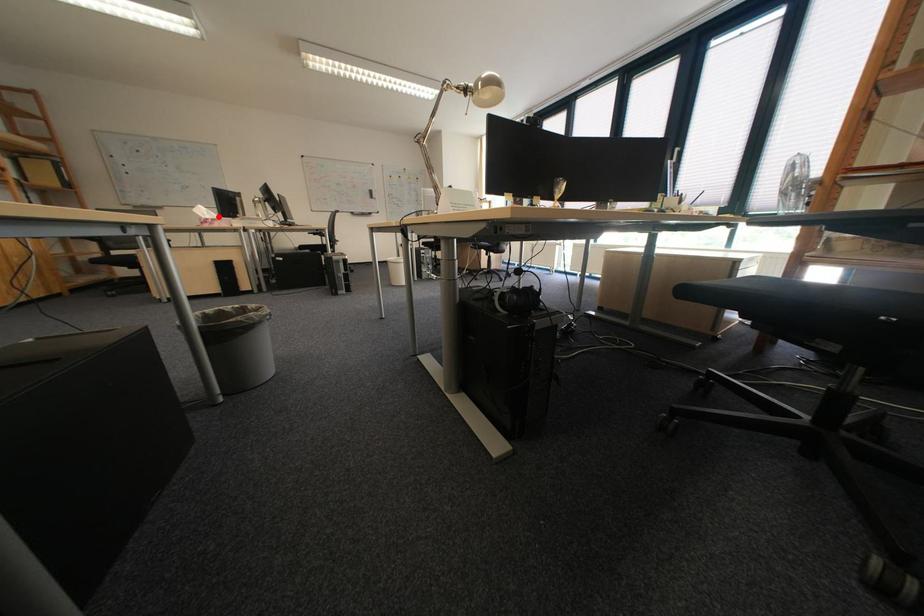
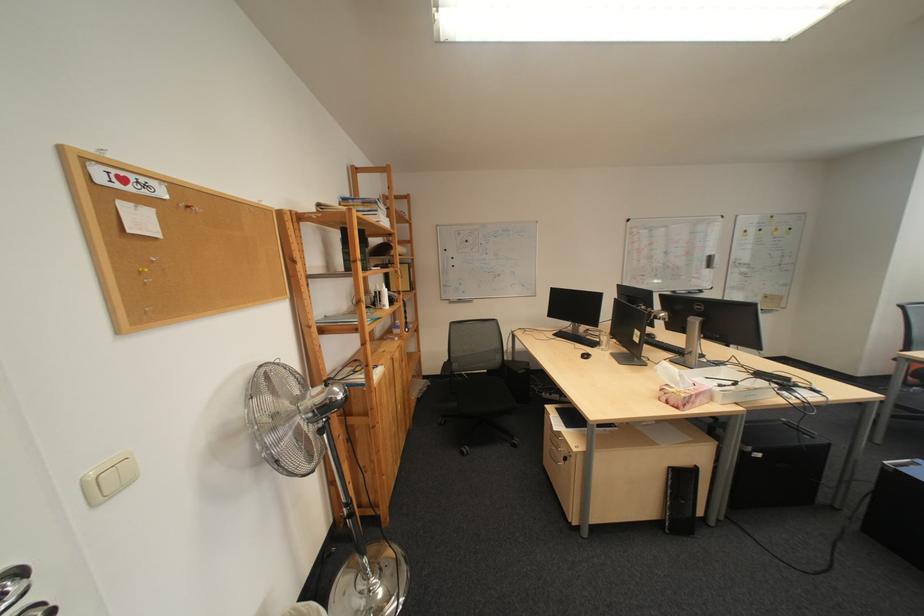
Question: I am providing you with two images of the same scene from different viewpoints. Image1 has a red point marked. In image2, the corresponding 3D location appears at what relative position? Reply with the corresponding letter.

Choices:
 (A) Closer
 (B) Farther

Answer: (B)